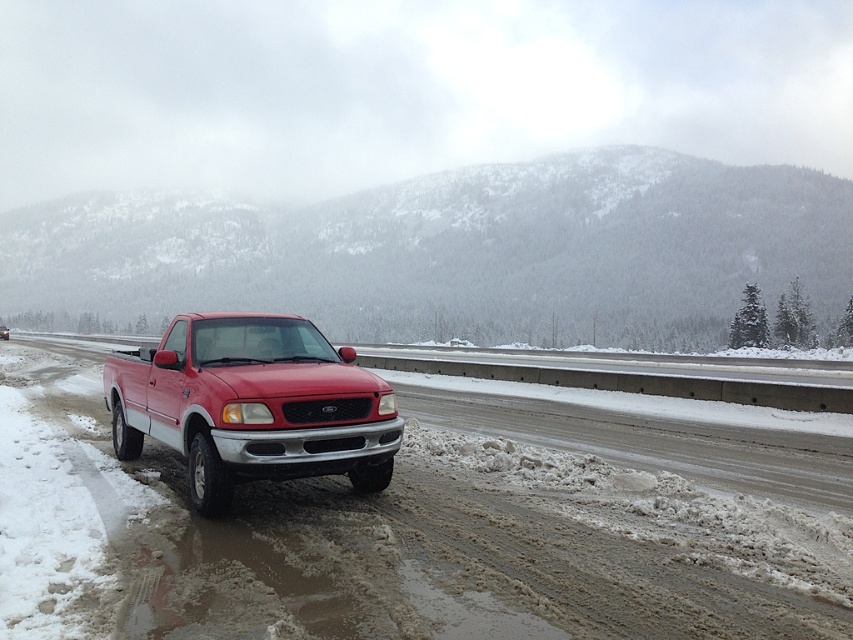
Which is more to the left, slick rubber tire at center or glossy red truck at center?

glossy red truck at center is more to the left.

Can you confirm if slick rubber tire at center is positioned above glossy red truck at center?

No, slick rubber tire at center is not above glossy red truck at center.

The height and width of the screenshot is (640, 853). Find the location of `slick rubber tire at center`. slick rubber tire at center is located at coordinates (386, 541).

Is matte red pickup truck at center to the left of glossy red truck at center from the viewer's perspective?

In fact, matte red pickup truck at center is to the right of glossy red truck at center.

Is matte red pickup truck at center shorter than glossy red truck at center?

Yes, matte red pickup truck at center is shorter than glossy red truck at center.

Where is `matte red pickup truck at center`? matte red pickup truck at center is located at coordinates (252, 404).

Does slick rubber tire at center appear under snowy forested mountain at upper center?

Indeed, slick rubber tire at center is positioned under snowy forested mountain at upper center.

Who is higher up, slick rubber tire at center or snowy forested mountain at upper center?

snowy forested mountain at upper center is higher up.

What do you see at coordinates (386, 541) in the screenshot? I see `slick rubber tire at center` at bounding box center [386, 541].

At what (x,y) coordinates should I click in order to perform the action: click on slick rubber tire at center. Please return your answer as a coordinate pair (x, y). This screenshot has height=640, width=853. Looking at the image, I should click on (386, 541).